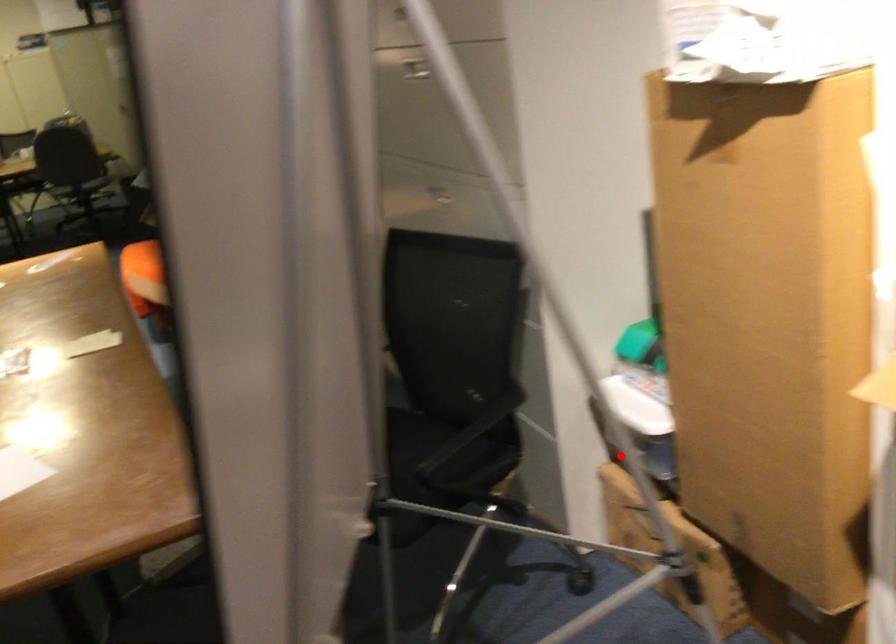
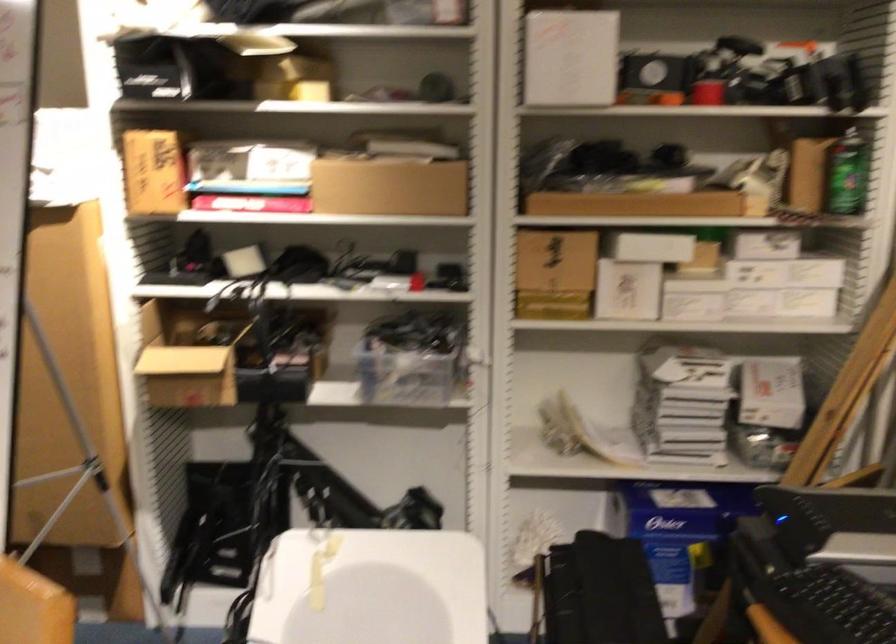
Find the pixel in the second image that matches the highlighted location in the first image.

(73, 412)